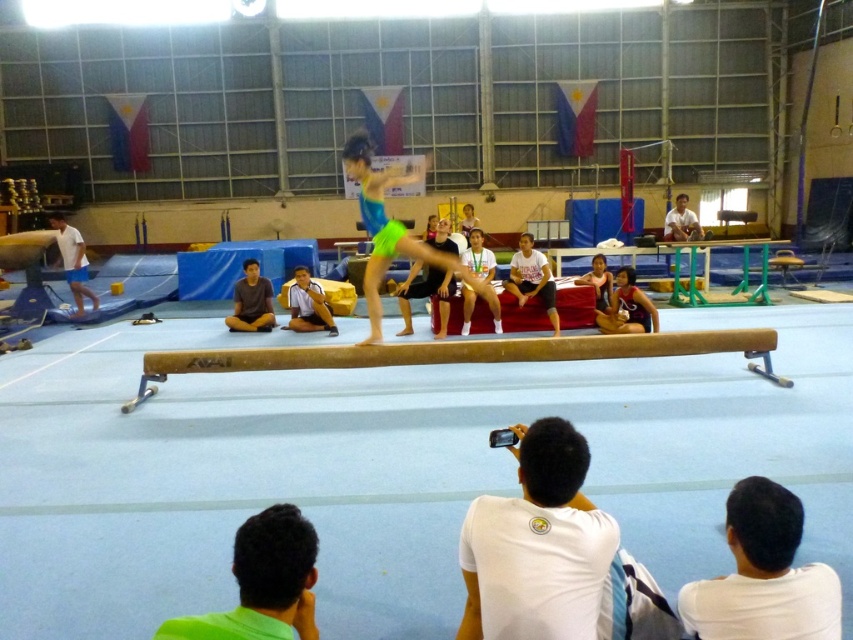
You are a photographer positioned at the front of the gymnasium, aiming to capture a clear shot of the gymnast on the balance beam. You notice two individuals wearing white matte shirt at lower right and green fabric shirt at lower left in your frame. Which shirt should you adjust your focus to avoid blurring due to distance?

The white matte shirt at lower right is closer to you than the green fabric shirt at lower left, so you should focus on the white matte shirt at lower right to avoid blurring caused by distance.

You are standing in the gymnasium and see the white matte shirt at lower right. If you want to hand something to the person wearing it without moving closer, can you do it?

The white matte shirt at lower right and viewer are 6.75 feet apart, so you cannot hand something to the person without moving closer because the distance is too far to reach.

You are a photographer setting up a camera to capture the neon green fabric gymnast at center and the white cotton shirt at center. The camera has a fixed width of 1.2 meters. Will both subjects fit within the camera frame if the camera is positioned to include both?

The neon green fabric gymnast at center might be wider than the white cotton shirt at center. Since the camera has a fixed width of 1.2 meters, it is uncertain if both will fit without overlapping or cropping. The width of the gymnast compared to the shirt affects the total required space.